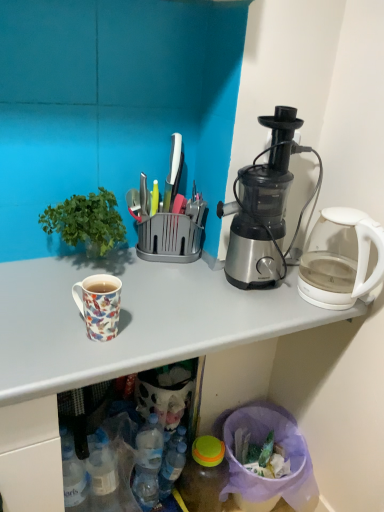
This screenshot has width=384, height=512. What are the coordinates of `free space that is in between satin silver blender at right and transparent glass kettle at right` in the screenshot? It's located at (281, 305).